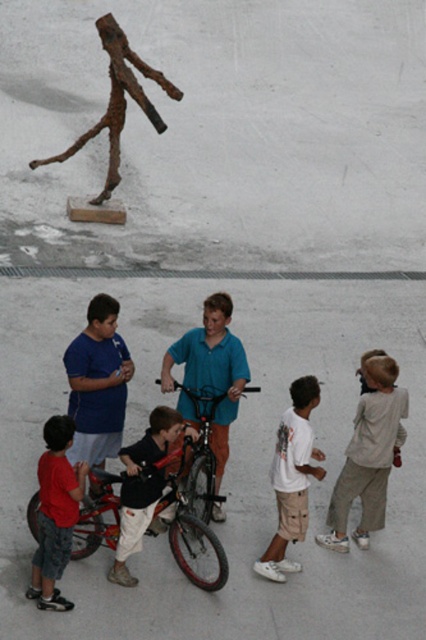
You are a photographer trying to capture a clear shot of the shiny metallic bicycle at center without any obstruction. From your current position, you notice the light beige cotton pants at lower right. What should you do to ensure the bicycle is fully visible?

Move to the left side of the shiny metallic bicycle at center so that the light beige cotton pants at lower right, which is positioned under it, will no longer block your view.

You are a photographer standing in the courtyard. You want to take a photo that includes both the white cotton shirt at center and the rusty metal stick figure at upper left. Which object should you focus on first to ensure both are in frame?

The white cotton shirt at center is shorter than the rusty metal stick figure at upper left, so you should focus on the rusty metal stick figure at upper left first to ensure both are in frame.